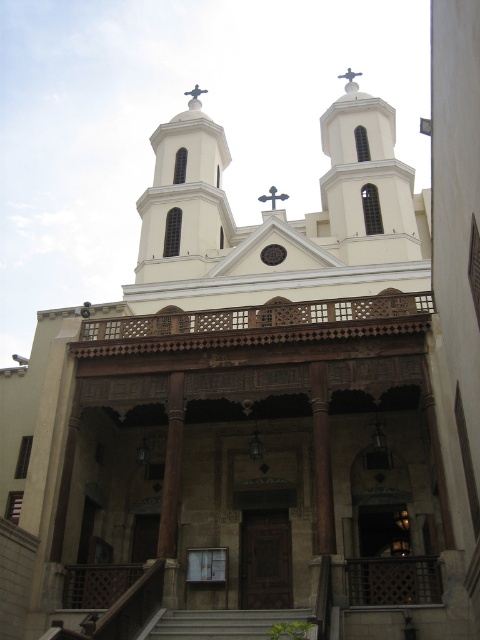
You are standing in front of the church and want to enter through the main entrance. You notice the white smooth tower at center and the gray concrete stairs at center. Which object is closer to the entrance area?

The gray concrete stairs at center are closer to the entrance area because the white smooth tower at center is positioned to the left side of the stairs, placing it further away from the entrance.

You are an architect visiting the church and need to determine which tower is bigger between the white stone tower at upper center and the white smooth tower at center. Which one is larger?

The white stone tower at upper center is larger in size than the white smooth tower at center.

You are an architect evaluating the church design. You need to determine if the white stone tower at upper center can be seen from the street level without obstruction. The gray concrete stairs at center are in the line of sight. Based on their widths, can the tower be viewed from the street?

The white stone tower at upper center is wider than the gray concrete stairs at center. Since the tower is wider, it would likely extend beyond the stairs, making it visible from the street level without obstruction.